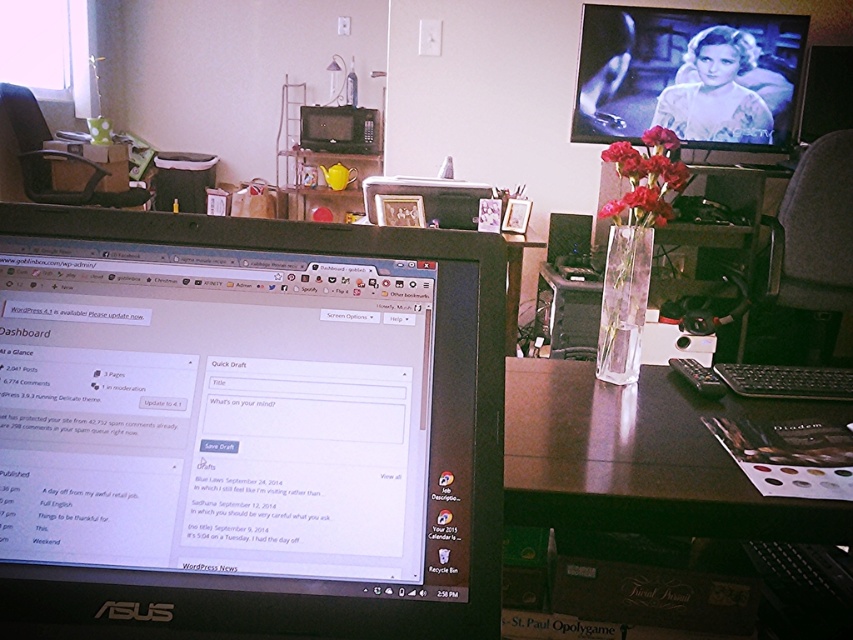
Who is positioned more to the right, black glossy table at center or matte black monitor at upper right?

Positioned to the right is matte black monitor at upper right.

Is point (555, 401) in front of point (648, 122)?

That is True.

Locate an element on the screen. The image size is (853, 640). black glossy table at center is located at coordinates (643, 458).

Is black glossy monitor at center taller than matte black monitor at upper right?

No.

Can you confirm if black glossy monitor at center is wider than matte black monitor at upper right?

In fact, black glossy monitor at center might be narrower than matte black monitor at upper right.

Where is `black glossy monitor at center`? black glossy monitor at center is located at coordinates (247, 428).

I want to click on black glossy monitor at center, so click(x=247, y=428).

Does black glossy monitor at center come in front of matte glass vase at center?

Yes, it is.

Which is behind, point (91, 442) or point (664, 161)?

The point (664, 161) is more distant.

Find the location of `black glossy monitor at center`. black glossy monitor at center is located at coordinates (247, 428).